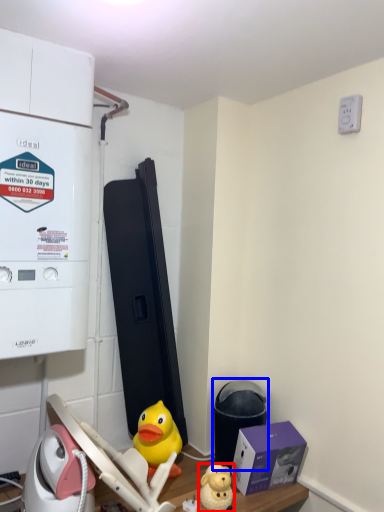
Question: Which object appears farthest to the camera in this image, toy (highlighted by a red box) or water heater (highlighted by a blue box)?

Choices:
 (A) toy
 (B) water heater

Answer: (B)